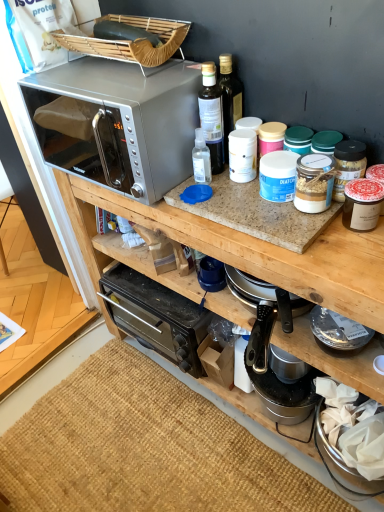
At what (x,y) coordinates should I click in order to perform the action: click on free location to the left of matte glass jar at right, positioned as the 2th appliance in bottom-to-top order. Please return your answer as a coordinate pair (x, y). The height and width of the screenshot is (512, 384). Looking at the image, I should click on (309, 244).